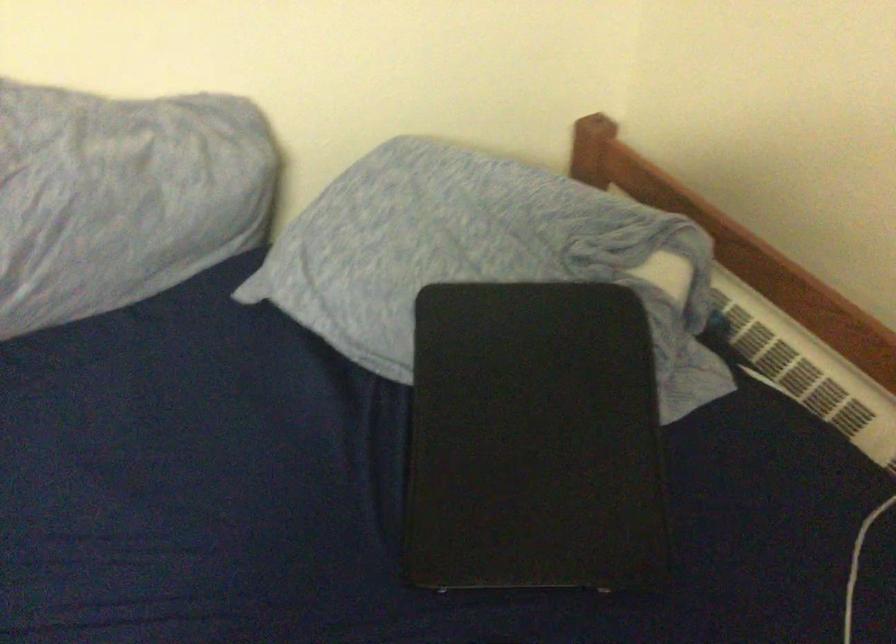
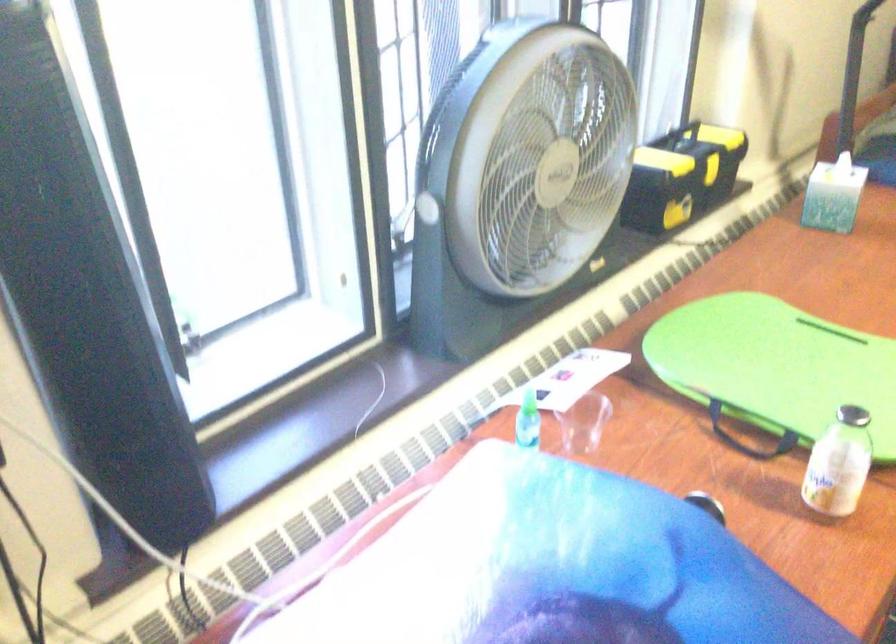
The images are taken continuously from a first-person perspective. In which direction is your viewpoint rotating?

The camera's rotation is toward right-down.